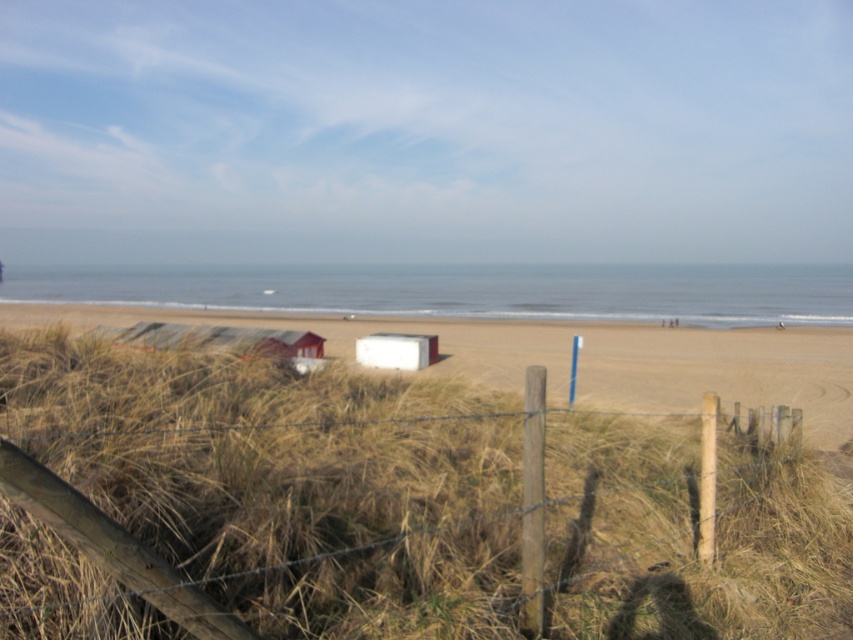
Is point (169, 365) farther from camera compared to point (477, 340)?

That is False.

Between point (165, 528) and point (753, 385), which one is positioned in front?

Point (165, 528) is more forward.

The height and width of the screenshot is (640, 853). What do you see at coordinates (287, 481) in the screenshot?
I see `golden dry grass at center` at bounding box center [287, 481].

This screenshot has width=853, height=640. Identify the location of golden dry grass at center. (287, 481).

Can you confirm if beige sandy beach at center is shorter than white matte beach hut at center?

Incorrect, beige sandy beach at center's height does not fall short of white matte beach hut at center's.

Can you confirm if beige sandy beach at center is bigger than white matte beach hut at center?

Indeed, beige sandy beach at center has a larger size compared to white matte beach hut at center.

This screenshot has height=640, width=853. Find the location of `beige sandy beach at center`. beige sandy beach at center is located at coordinates (578, 356).

How far apart are golden dry grass at center and white matte beach hut at center?

They are 18.03 meters apart.

Which is below, golden dry grass at center or white matte beach hut at center?

Positioned lower is white matte beach hut at center.

I want to click on golden dry grass at center, so click(x=287, y=481).

Locate an element on the screen. Image resolution: width=853 pixels, height=640 pixels. golden dry grass at center is located at coordinates (287, 481).